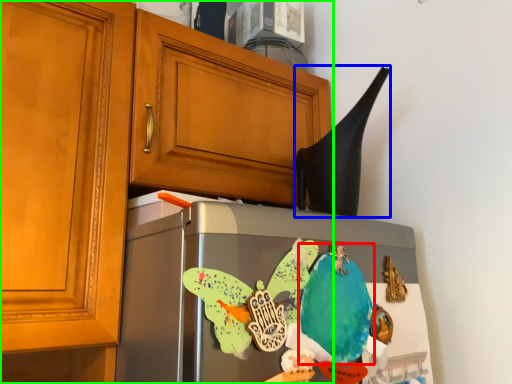
Question: Estimate the real-world distances between objects in this image. Which object is closer to parrot (highlighted by a red box), exhaust hood (highlighted by a blue box) or cabinetry (highlighted by a green box)?

Choices:
 (A) exhaust hood
 (B) cabinetry

Answer: (A)